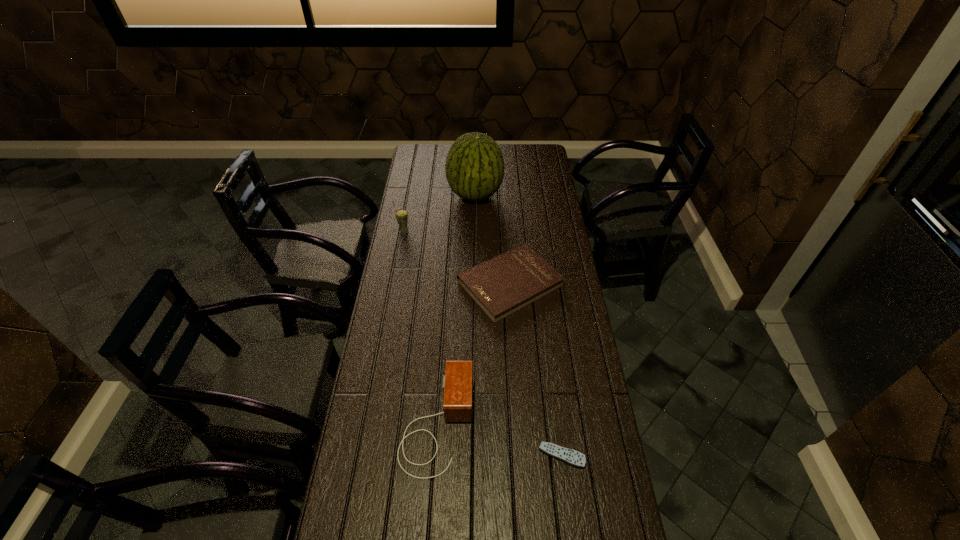
The height and width of the screenshot is (540, 960). I want to click on the third closest object to the leftmost object, so click(458, 380).

Locate which object is the closest to the remote control. Please provide its 2D coordinates. Your answer should be formatted as a tuple, i.e. [(x, y)], where the tuple contains the x and y coordinates of a point satisfying the conditions above.

[(458, 380)]

Identify the location of free space that satisfies the following two spatial constraints: 1. on the front-facing side of the radio receiver; 2. on the back side of the remote control. (435, 455).

The width and height of the screenshot is (960, 540). In order to click on vacant area in the image that satisfies the following two spatial constraints: 1. on the front side of the farthest object; 2. on the front-facing side of the radio receiver in this screenshot , I will do `click(472, 423)`.

This screenshot has width=960, height=540. I want to click on vacant space that satisfies the following two spatial constraints: 1. on the front side of the watermelon; 2. on the front-facing side of the radio receiver, so click(472, 423).